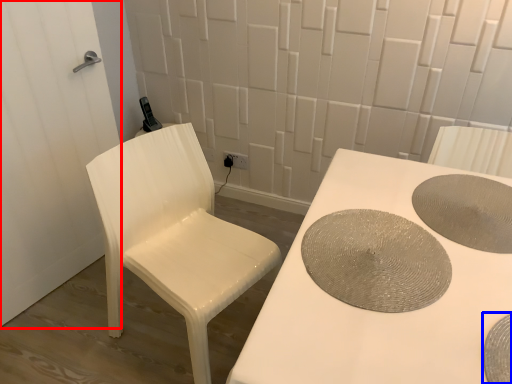
Question: Which object is closer to the camera taking this photo, screen door (highlighted by a red box) or manhole cover (highlighted by a blue box)?

Choices:
 (A) screen door
 (B) manhole cover

Answer: (B)